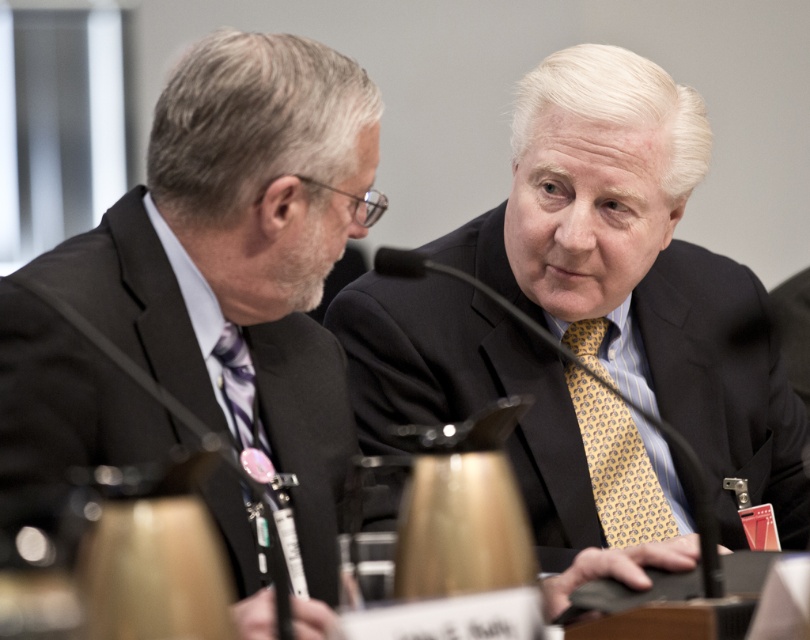
Does matte black suit at left have a lesser height compared to yellowpatterned fabrictie at center?

No, matte black suit at left is not shorter than yellowpatterned fabrictie at center.

Where is `matte black suit at left`? matte black suit at left is located at coordinates (244, 260).

The image size is (810, 640). In order to click on matte black suit at left in this screenshot , I will do `click(244, 260)`.

Who is more distant from viewer, (43, 257) or (254, 397)?

Positioned behind is point (254, 397).

Between point (192, 138) and point (291, 568), which one is positioned in front?

Point (192, 138) is in front.

The width and height of the screenshot is (810, 640). What are the coordinates of `matte black suit at left` in the screenshot? It's located at click(244, 260).

Does matte black suit at center come behind yellowpatterned fabrictie at center?

That is False.

Can you confirm if matte black suit at center is positioned below yellowpatterned fabrictie at center?

Incorrect, matte black suit at center is not positioned below yellowpatterned fabrictie at center.

Who is more forward, (770, 369) or (663, 515)?

Point (663, 515)

Locate an element on the screen. matte black suit at center is located at coordinates [640, 269].